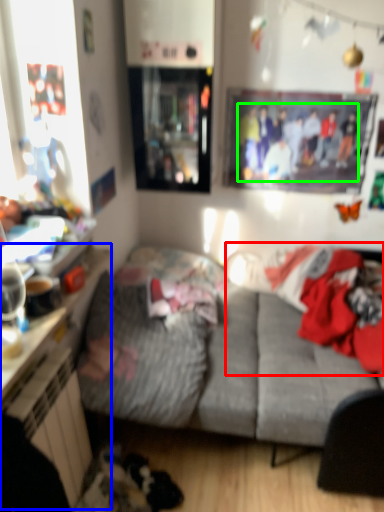
Question: Which object is positioned closest to laundry (highlighted by a red box)? Select from dresser (highlighted by a blue box) and couple (highlighted by a green box).

Choices:
 (A) dresser
 (B) couple

Answer: (B)